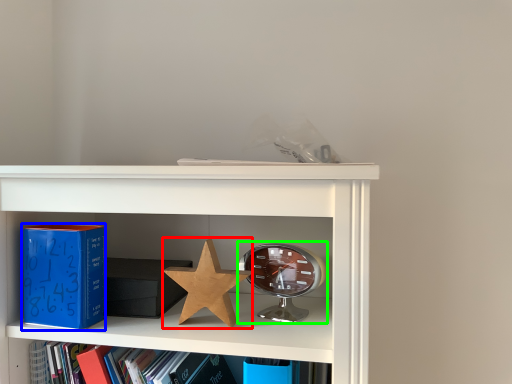
Question: Which object is positioned closest to star (highlighted by a red box)? Select from paperback book (highlighted by a blue box) and alarm clock (highlighted by a green box).

Choices:
 (A) paperback book
 (B) alarm clock

Answer: (B)